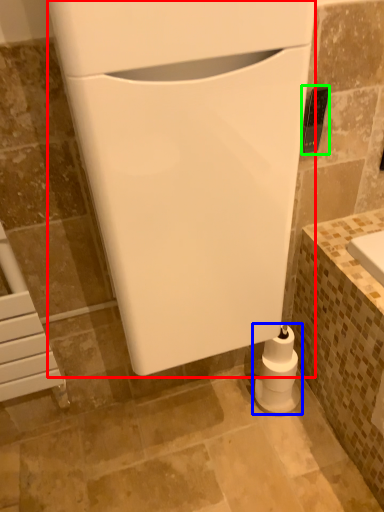
Question: Which object is the farthest from appliance (highlighted by a red box)? Choose among these: toilet paper (highlighted by a blue box) or appliance (highlighted by a green box).

Choices:
 (A) toilet paper
 (B) appliance

Answer: (A)